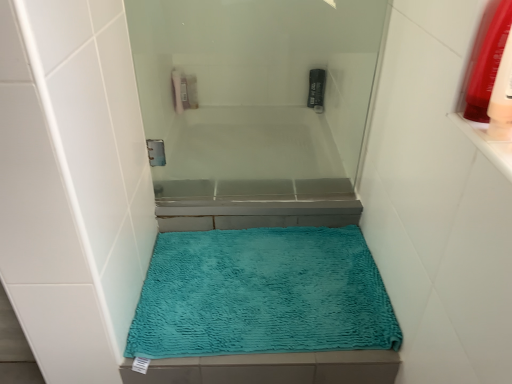
Question: Which direction should I rotate to face black plastic mouthwash at upper center, which ranks as the second mouthwash in bottom-to-top order, — up or down?

Choices:
 (A) down
 (B) up

Answer: (B)

Question: Does transparent glass screen door at upper center have a lesser width compared to black plastic mouthwash at upper center, which appears as the second mouthwash when viewed from the right?

Choices:
 (A) yes
 (B) no

Answer: (A)

Question: Considering the relative positions of transparent glass screen door at upper center and black plastic mouthwash at upper center, placed as the 1th mouthwash when sorted from top to bottom, in the image provided, is transparent glass screen door at upper center to the right of black plastic mouthwash at upper center, placed as the 1th mouthwash when sorted from top to bottom, from the viewer's perspective?

Choices:
 (A) no
 (B) yes

Answer: (A)

Question: Is transparent glass screen door at upper center at the left side of black plastic mouthwash at upper center, the 2th mouthwash in the front-to-back sequence?

Choices:
 (A) yes
 (B) no

Answer: (A)

Question: Can you confirm if transparent glass screen door at upper center is smaller than black plastic mouthwash at upper center, the 2th mouthwash in the front-to-back sequence?

Choices:
 (A) yes
 (B) no

Answer: (B)

Question: Does transparent glass screen door at upper center have a lesser height compared to black plastic mouthwash at upper center, the 2th mouthwash in the front-to-back sequence?

Choices:
 (A) no
 (B) yes

Answer: (A)

Question: From a real-world perspective, is transparent glass screen door at upper center physically above black plastic mouthwash at upper center, the 2th mouthwash in the front-to-back sequence?

Choices:
 (A) yes
 (B) no

Answer: (A)

Question: Is translucent plastic mouthwash at upper right, which ranks as the second mouthwash in back-to-front order, in contact with teal plush bath mat at center?

Choices:
 (A) yes
 (B) no

Answer: (B)

Question: Is translucent plastic mouthwash at upper right, marked as the 2th mouthwash in a top-to-bottom arrangement, taller than teal plush bath mat at center?

Choices:
 (A) yes
 (B) no

Answer: (A)

Question: Can teal plush bath mat at center be found inside translucent plastic mouthwash at upper right, marked as the first mouthwash in a right-to-left arrangement?

Choices:
 (A) yes
 (B) no

Answer: (B)

Question: Is translucent plastic mouthwash at upper right, which appears as the second mouthwash when viewed from the left, to the left of teal plush bath mat at center from the viewer's perspective?

Choices:
 (A) no
 (B) yes

Answer: (A)

Question: From the image's perspective, is translucent plastic mouthwash at upper right, which appears as the second mouthwash when viewed from the left, beneath teal plush bath mat at center?

Choices:
 (A) yes
 (B) no

Answer: (B)

Question: Is translucent plastic mouthwash at upper right, which ranks as the 1th mouthwash in bottom-to-top order, shorter than teal plush bath mat at center?

Choices:
 (A) no
 (B) yes

Answer: (A)

Question: Considering the relative sizes of teal plush bath mat at center and black plastic mouthwash at upper center, which is the 1th mouthwash from back to front, in the image provided, is teal plush bath mat at center thinner than black plastic mouthwash at upper center, which is the 1th mouthwash from back to front,?

Choices:
 (A) yes
 (B) no

Answer: (B)